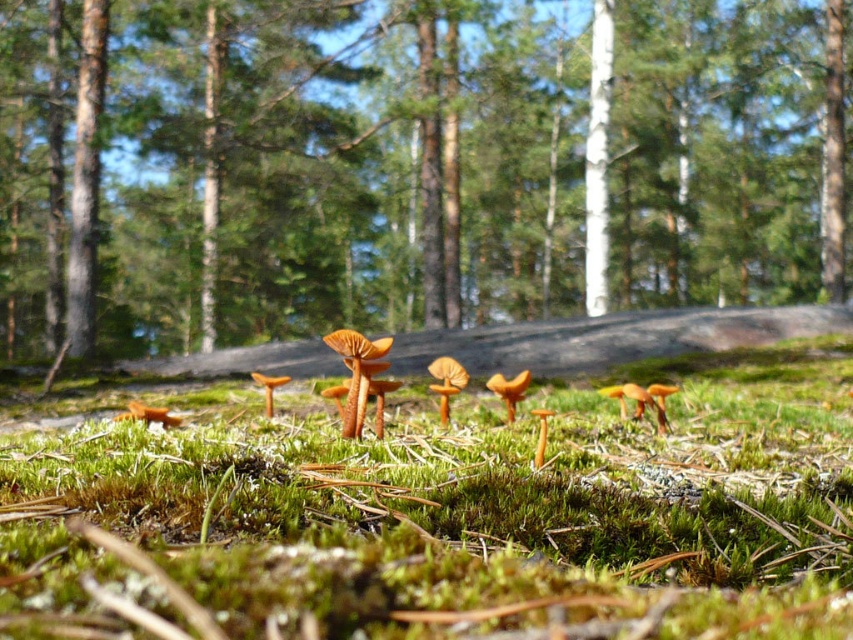
Question: Is brown wood tree at center smaller than green mossy ground at center?

Choices:
 (A) no
 (B) yes

Answer: (A)

Question: Which of the following is the farthest from the observer?

Choices:
 (A) brown wood tree at center
 (B) green mossy ground at center

Answer: (A)

Question: Can you confirm if brown wood tree at center is positioned below green mossy ground at center?

Choices:
 (A) no
 (B) yes

Answer: (A)

Question: Does brown wood tree at center appear on the left side of green mossy ground at center?

Choices:
 (A) yes
 (B) no

Answer: (B)